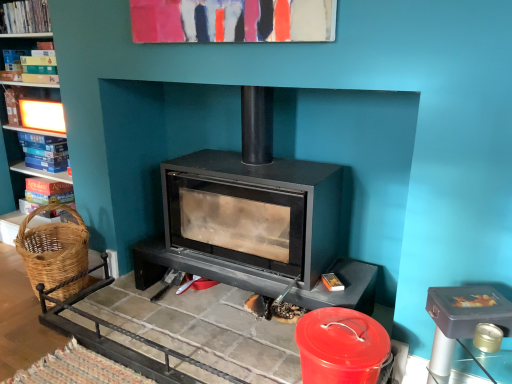
Question: Does blue cardboard book at left, the 2th book when ordered from bottom to top, have a greater height compared to hardcover book at left, which is counted as the 4th book, starting from the bottom?

Choices:
 (A) yes
 (B) no

Answer: (A)

Question: Can you confirm if blue cardboard book at left, the 2th book when ordered from bottom to top, is wider than hardcover book at left, the 1th book viewed from the top?

Choices:
 (A) no
 (B) yes

Answer: (A)

Question: From a real-world perspective, is blue cardboard book at left, the 2th book when ordered from bottom to top, physically above hardcover book at left, the 1th book viewed from the top?

Choices:
 (A) yes
 (B) no

Answer: (B)

Question: Is blue cardboard book at left, which appears as the third book when viewed from the top, at the left side of hardcover book at left, which is counted as the 4th book, starting from the bottom?

Choices:
 (A) no
 (B) yes

Answer: (B)

Question: Is the depth of blue cardboard book at left, which appears as the third book when viewed from the top, greater than that of hardcover book at left, which is counted as the 4th book, starting from the bottom?

Choices:
 (A) no
 (B) yes

Answer: (B)

Question: Is hardcover book at left, which is counted as the 4th book, starting from the bottom, a part of blue cardboard book at left, the 2th book when ordered from bottom to top?

Choices:
 (A) yes
 (B) no

Answer: (B)

Question: Is blue cardboard book at left, the 2th book when ordered from bottom to top, at the left side of hardcover book at left, the 2th book viewed from the top?

Choices:
 (A) no
 (B) yes

Answer: (A)

Question: Is blue cardboard book at left, which appears as the third book when viewed from the top, positioned in front of hardcover book at left, placed as the third book when sorted from bottom to top?

Choices:
 (A) no
 (B) yes

Answer: (A)

Question: From the image's perspective, does blue cardboard book at left, which appears as the third book when viewed from the top, appear lower than hardcover book at left, the 2th book viewed from the top?

Choices:
 (A) yes
 (B) no

Answer: (A)

Question: Is blue cardboard book at left, the 2th book when ordered from bottom to top, shorter than hardcover book at left, placed as the third book when sorted from bottom to top?

Choices:
 (A) yes
 (B) no

Answer: (B)

Question: Is blue cardboard book at left, the 2th book when ordered from bottom to top, bigger than hardcover book at left, placed as the third book when sorted from bottom to top?

Choices:
 (A) yes
 (B) no

Answer: (A)

Question: From the image's perspective, is blue cardboard book at left, which appears as the third book when viewed from the top, over hardcover book at left, the 2th book viewed from the top?

Choices:
 (A) yes
 (B) no

Answer: (B)

Question: Is matte cardboard book at left, arranged as the first book when ordered from the bottom, facing towards hardcover book at left, the 2th book viewed from the top?

Choices:
 (A) yes
 (B) no

Answer: (B)